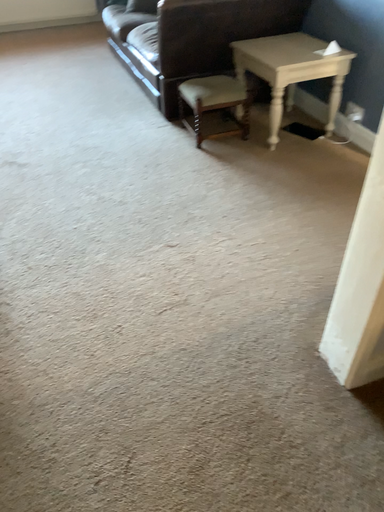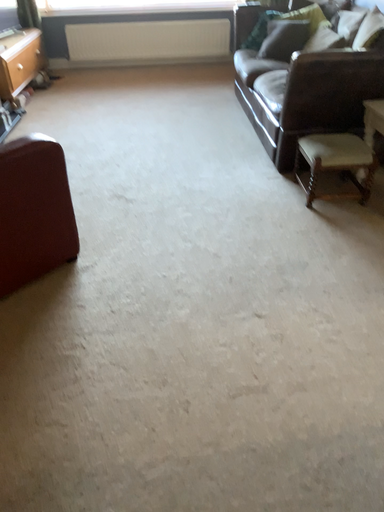
Question: Which way did the camera rotate in the video?

Choices:
 (A) rotated right
 (B) rotated left

Answer: (B)